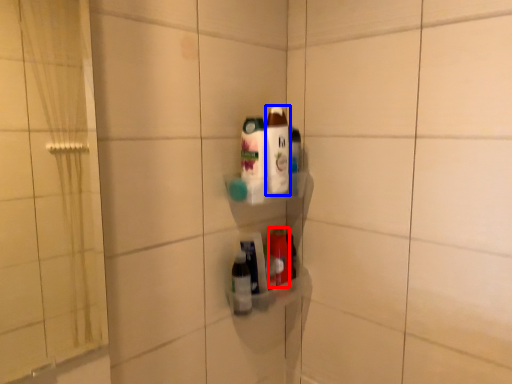
Question: Among these objects, which one is nearest to the camera, bottle (highlighted by a red box) or bottle (highlighted by a blue box)?

Choices:
 (A) bottle
 (B) bottle

Answer: (B)